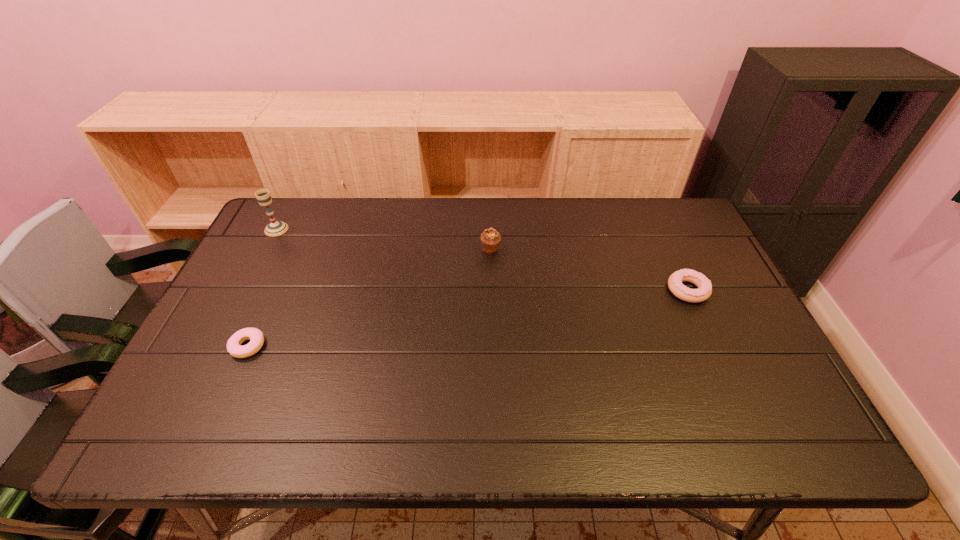
In the image, there is a desktop. What are the coordinates of `vacant region at the left edge` in the screenshot? It's located at (247, 384).

Image resolution: width=960 pixels, height=540 pixels. In the image, there is a desktop. What are the coordinates of `vacant space at the right edge` in the screenshot? It's located at (756, 340).

Image resolution: width=960 pixels, height=540 pixels. Find the location of `vacant space at the far left corner`. vacant space at the far left corner is located at coordinates (278, 205).

You are a GUI agent. You are given a task and a screenshot of the screen. Output one action in this format:
    pyautogui.click(x=<x>, y=<y>)
    Task: Click on the free space at the far right corner of the desktop
    This screenshot has width=960, height=540.
    Given the screenshot: What is the action you would take?
    pyautogui.click(x=656, y=233)

You are a GUI agent. You are given a task and a screenshot of the screen. Output one action in this format:
    pyautogui.click(x=<x>, y=<y>)
    Task: Click on the empty space between the farthest object and the right doughnut
    This screenshot has height=540, width=960.
    Given the screenshot: What is the action you would take?
    pyautogui.click(x=482, y=260)

What are the coordinates of `free space between the farthest object and the taller doughnut` in the screenshot? It's located at (482, 260).

I want to click on free space that is in between the third object from left to right and the farthest object, so click(x=383, y=239).

The image size is (960, 540). Find the location of `vacant space that's between the chalice and the third object from left to right`. vacant space that's between the chalice and the third object from left to right is located at coordinates (383, 239).

Identify the location of free spot between the rightmost object and the farthest object. (482, 260).

Where is `empty space between the chalice and the second tallest object`? This screenshot has width=960, height=540. empty space between the chalice and the second tallest object is located at coordinates (383, 239).